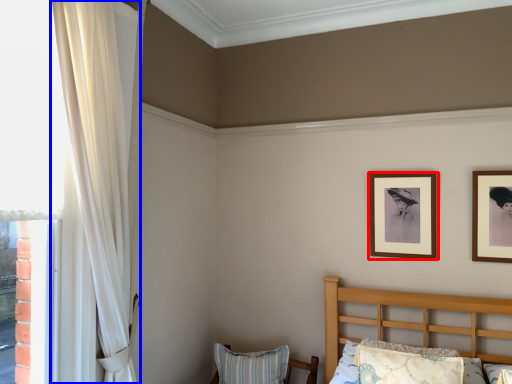
Question: Which object appears farthest to the camera in this image, picture frame (highlighted by a red box) or curtain (highlighted by a blue box)?

Choices:
 (A) picture frame
 (B) curtain

Answer: (A)